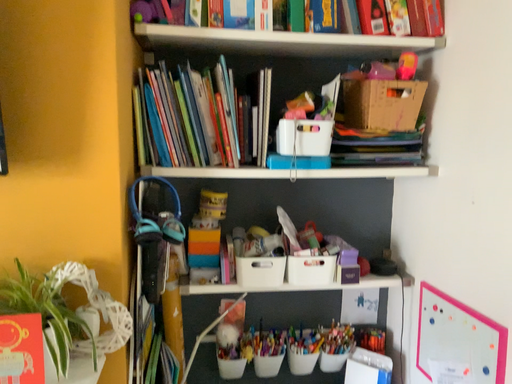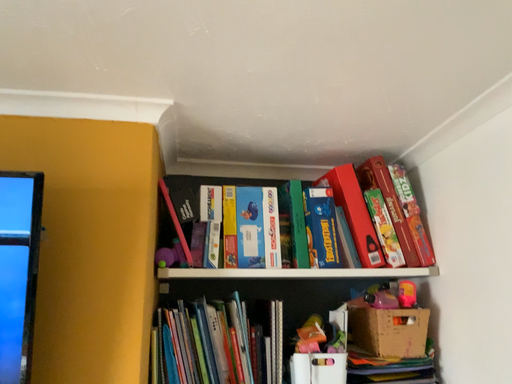
Question: How did the camera likely rotate when shooting the video?

Choices:
 (A) rotated downward
 (B) rotated upward

Answer: (B)